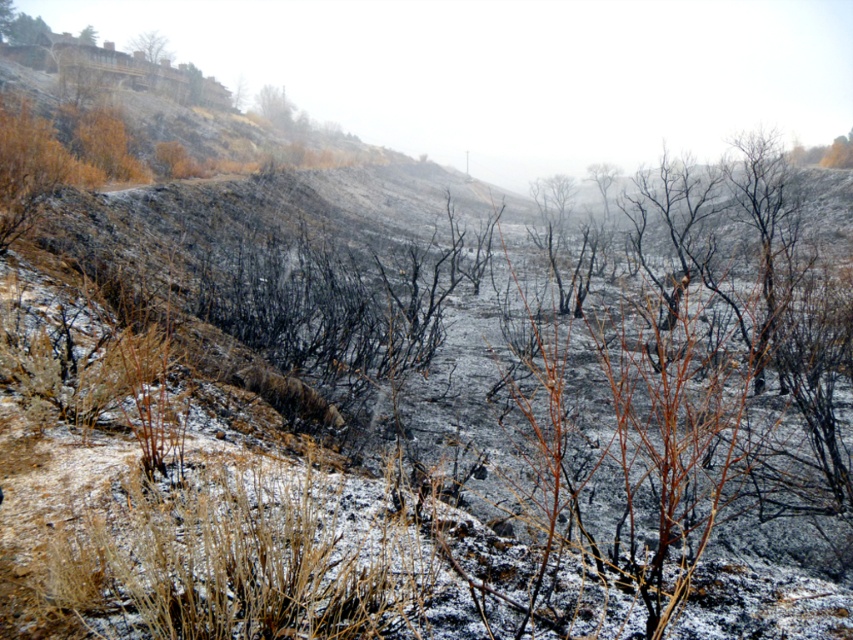
You are a firefighter assessing the fire damage. You notice the brown dry branches at upper center and the brown wood tree at upper left. Which of these two objects takes up more space in the image?

The brown wood tree at upper left occupies more space than the brown dry branches at upper center.